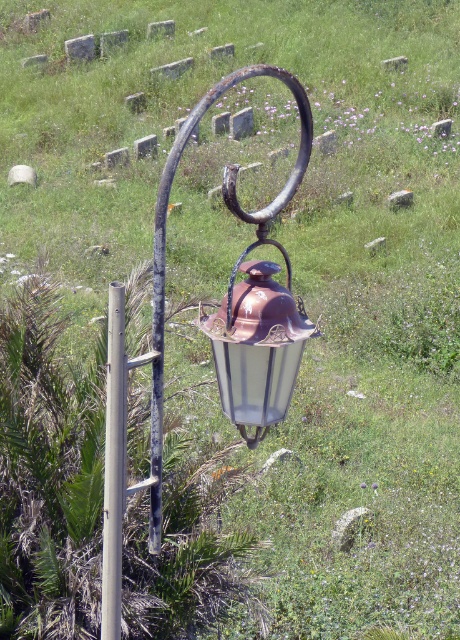
Question: Observing the image, what is the correct spatial positioning of rusty metal lantern at center in reference to silver metallic pole at center-left?

Choices:
 (A) below
 (B) above

Answer: (B)

Question: Which point is closer to the camera?

Choices:
 (A) copper/textured lantern at center
 (B) rusty metal lantern at center
 (C) silver metallic pole at center-left

Answer: (B)

Question: Estimate the real-world distances between objects in this image. Which object is closer to the rusty metal lantern at center?

Choices:
 (A) copper/textured lantern at center
 (B) silver metallic pole at center-left

Answer: (B)

Question: Which of these objects is positioned farthest from the rusty metal lantern at center?

Choices:
 (A) silver metallic pole at center-left
 (B) copper/textured lantern at center

Answer: (B)

Question: Where is rusty metal lantern at center located in relation to silver metallic pole at center-left in the image?

Choices:
 (A) above
 (B) below

Answer: (A)

Question: Can you confirm if copper/textured lantern at center is thinner than rusty metal lantern at center?

Choices:
 (A) no
 (B) yes

Answer: (B)